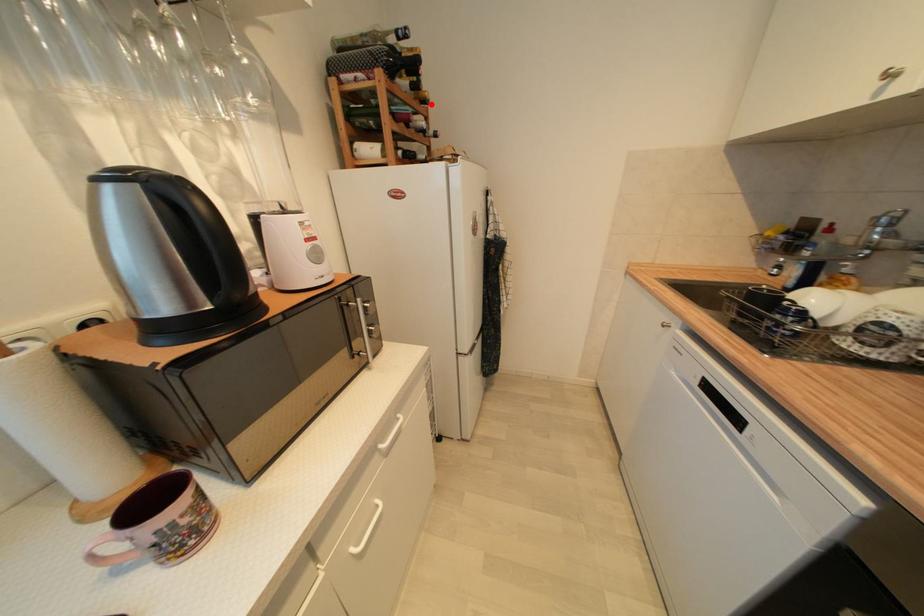
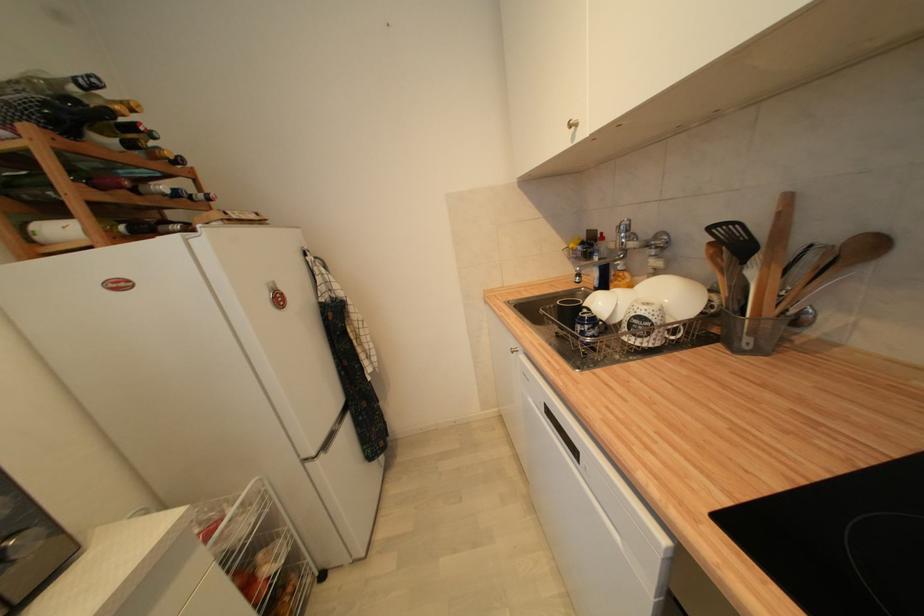
The point at the highlighted location is marked in the first image. Where is the corresponding point in the second image?

(186, 164)